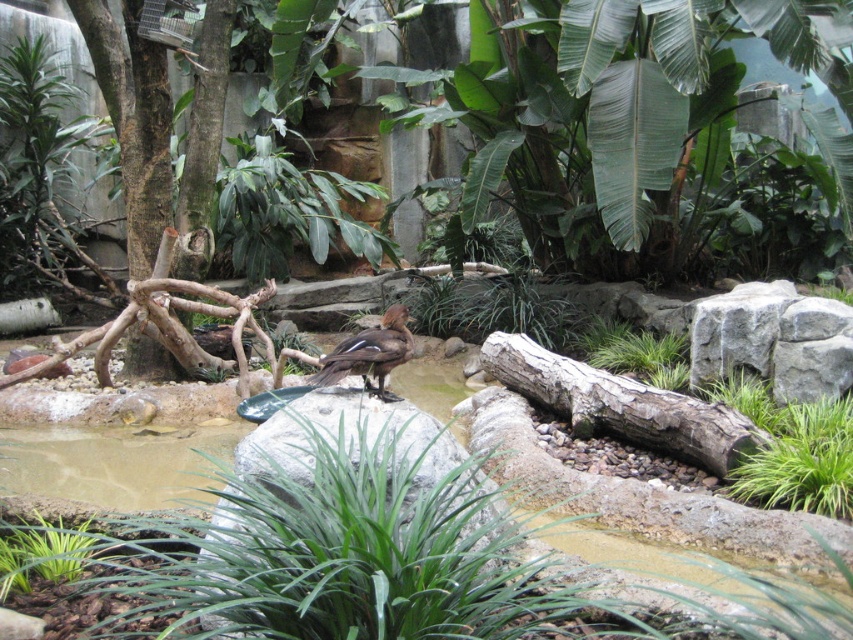
You are a visitor observing the tropical enclosure and want to take a photo of the brown feathered bird at center without including the green leafy plant at lower left in the frame. Is this possible based on their positions?

The green leafy plant at lower left is below the brown feathered bird at center, so if you position your camera to focus on the bird at center while avoiding the lower left area, you can exclude the plant from the photo.

You are a zookeeper tasked with arranging plants and animals in the enclosure. You need to place a new decorative rock between the green leafy plant at lower left and the brown feathered bird at center. Since the rock is 1 meter wide, will it fit between them considering their sizes?

The green leafy plant at lower left is narrower than the brown feathered bird at center. However, the exact distance between them isn